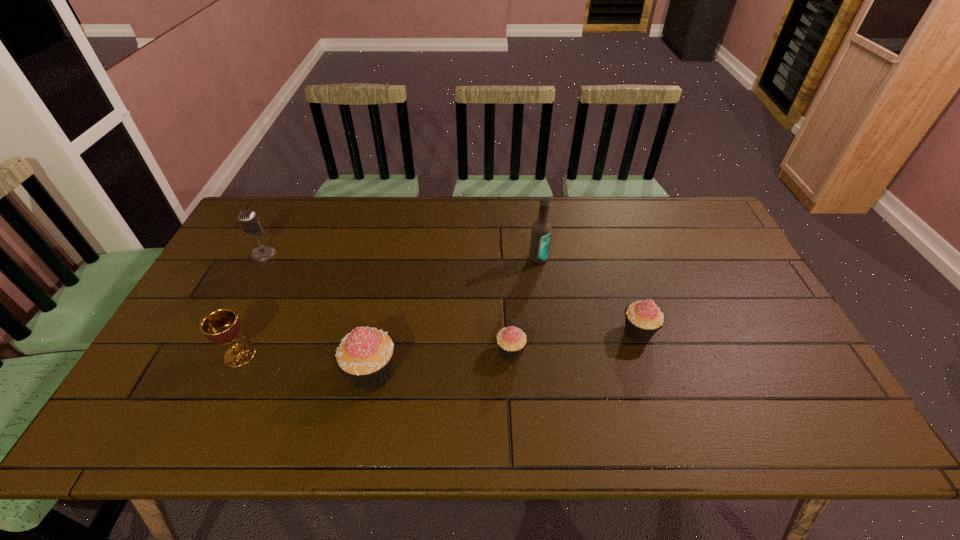
The width and height of the screenshot is (960, 540). I want to click on vacant space located 0.390m on the back of the third object from left to right, so click(396, 249).

Locate an element on the screen. vacant region located on the back of the second cupcake from right to left is located at coordinates (506, 275).

Find the location of `free spot located 0.320m on the back of the second tallest cupcake`. free spot located 0.320m on the back of the second tallest cupcake is located at coordinates (610, 241).

At what (x,y) coordinates should I click in order to perform the action: click on blank space located on the left of the chalice. Please return your answer as a coordinate pair (x, y). Looking at the image, I should click on (177, 355).

Where is `blank space located 0.210m on the right of the microphone`? blank space located 0.210m on the right of the microphone is located at coordinates pos(342,254).

Locate an element on the screen. vacant position located on the side of the beer bottle with the label is located at coordinates coord(554,378).

Where is `cupcake present at the near edge`? cupcake present at the near edge is located at coordinates [x=365, y=356].

Where is `chalice situated at the near edge`? The width and height of the screenshot is (960, 540). chalice situated at the near edge is located at coordinates (222, 326).

At what (x,y) coordinates should I click in order to perform the action: click on chalice present at the left edge. Please return your answer as a coordinate pair (x, y). Looking at the image, I should click on (222, 326).

At what (x,y) coordinates should I click in order to perform the action: click on microphone at the left edge. Please return your answer as a coordinate pair (x, y). Looking at the image, I should click on (250, 224).